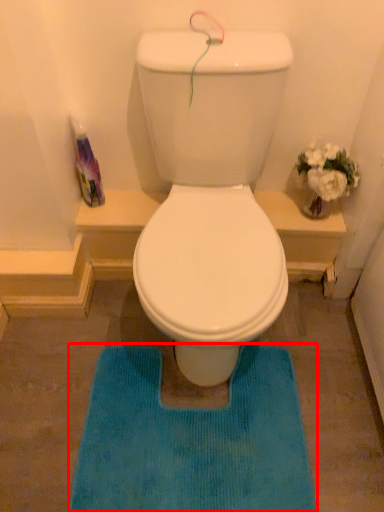
Question: Where is bath mat (annotated by the red box) located in relation to bottle in the image?

Choices:
 (A) left
 (B) right

Answer: (B)